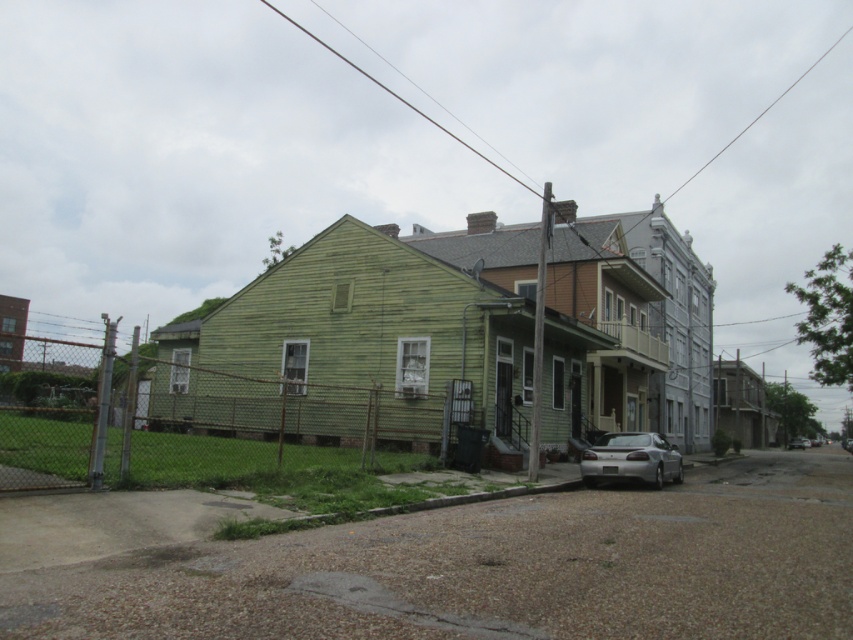
Question: Can you confirm if silver metallic sedan at lower right is positioned to the left of silver metallic sedan at center?

Choices:
 (A) yes
 (B) no

Answer: (A)

Question: Which object is farther from the camera taking this photo?

Choices:
 (A) silver metallic sedan at center
 (B) silver metallic sedan at lower right

Answer: (A)

Question: Which object appears closest to the camera in this image?

Choices:
 (A) silver metallic sedan at lower right
 (B) silver metallic sedan at center

Answer: (A)

Question: Can you confirm if silver metallic sedan at lower right is positioned above silver metallic sedan at center?

Choices:
 (A) no
 (B) yes

Answer: (B)

Question: From the image, what is the correct spatial relationship of silver metallic sedan at lower right in relation to silver metallic sedan at center?

Choices:
 (A) right
 (B) left

Answer: (B)

Question: Among these objects, which one is farthest from the camera?

Choices:
 (A) silver metallic sedan at center
 (B) silver metallic sedan at lower right

Answer: (A)